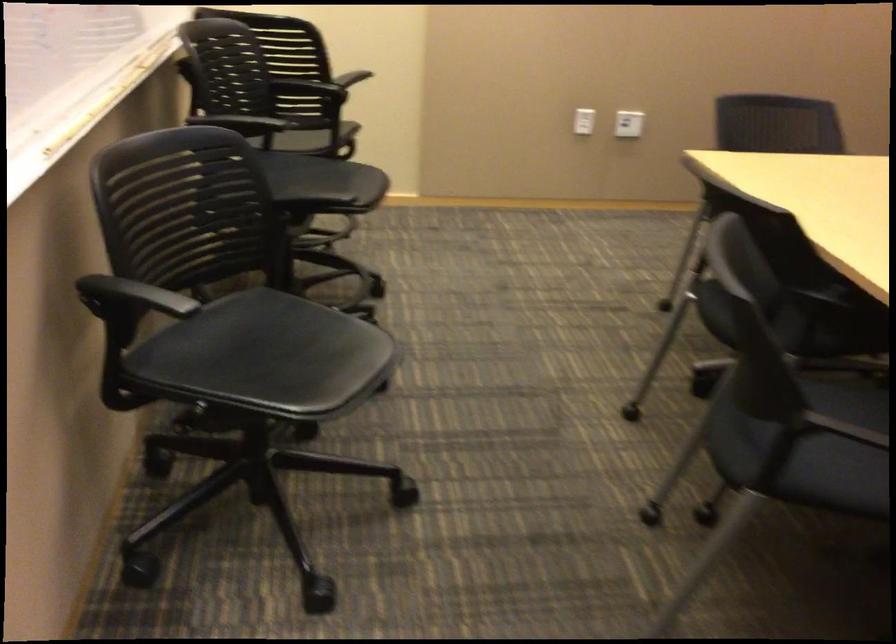
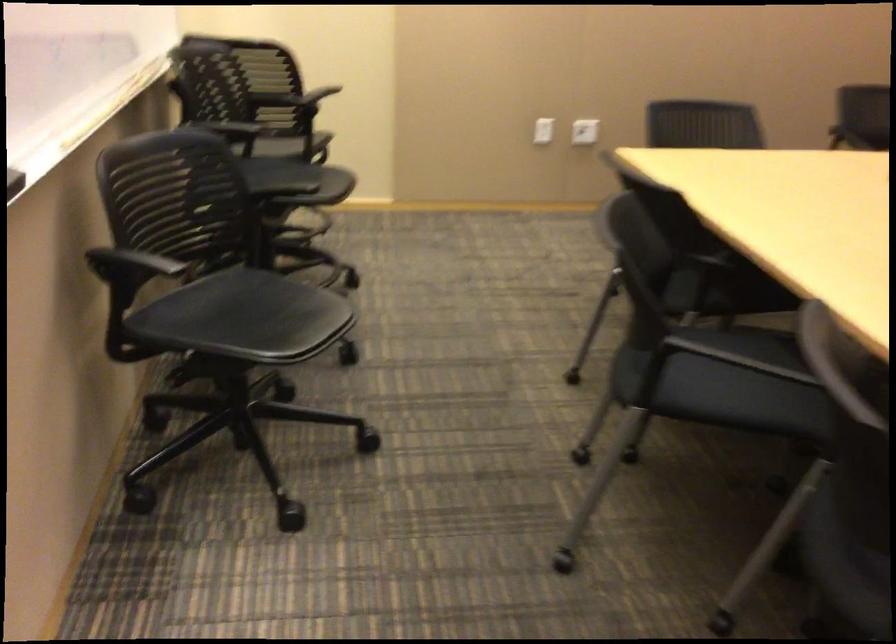
Question: How did the camera likely rotate?

Choices:
 (A) Left
 (B) Right
 (C) Up
 (D) Down

Answer: (C)